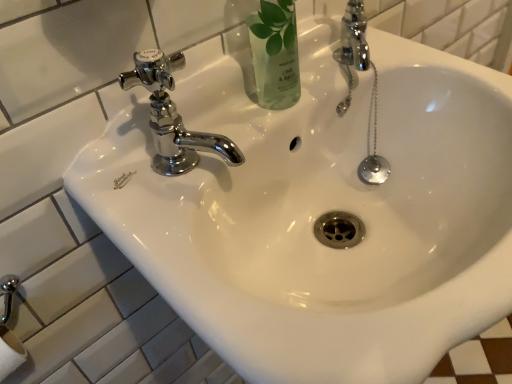
What do you see at coordinates (275, 54) in the screenshot? This screenshot has height=384, width=512. I see `clear glass bottle at upper center` at bounding box center [275, 54].

The width and height of the screenshot is (512, 384). What are the coordinates of `clear glass bottle at upper center` in the screenshot? It's located at (275, 54).

What do you see at coordinates (173, 117) in the screenshot?
I see `chrome/metallic faucet at upper left` at bounding box center [173, 117].

You are a GUI agent. You are given a task and a screenshot of the screen. Output one action in this format:
    pyautogui.click(x=<x>, y=<y>)
    Task: Click on the chrome/metallic faucet at upper left
    
    Given the screenshot: What is the action you would take?
    pyautogui.click(x=173, y=117)

I want to click on clear glass bottle at upper center, so 275,54.

Which is more to the right, clear glass bottle at upper center or chrome/metallic faucet at upper left?

Positioned to the right is clear glass bottle at upper center.

Considering the relative positions of clear glass bottle at upper center and chrome/metallic faucet at upper left in the image provided, is clear glass bottle at upper center behind chrome/metallic faucet at upper left?

Yes.

Does point (288, 49) appear closer or farther from the camera than point (155, 75)?

Point (288, 49) is positioned farther from the camera compared to point (155, 75).

From the image's perspective, which one is positioned lower, clear glass bottle at upper center or chrome/metallic faucet at upper left?

From the image's view, chrome/metallic faucet at upper left is below.

From a real-world perspective, is clear glass bottle at upper center located higher than chrome/metallic faucet at upper left?

Yes, from a real-world perspective, clear glass bottle at upper center is above chrome/metallic faucet at upper left.

Which of these two, clear glass bottle at upper center or chrome/metallic faucet at upper left, is thinner?

chrome/metallic faucet at upper left.

Considering the relative sizes of clear glass bottle at upper center and chrome/metallic faucet at upper left in the image provided, is clear glass bottle at upper center shorter than chrome/metallic faucet at upper left?

No.

Considering the sizes of objects clear glass bottle at upper center and chrome/metallic faucet at upper left in the image provided, who is bigger, clear glass bottle at upper center or chrome/metallic faucet at upper left?

clear glass bottle at upper center.

Consider the image. Is clear glass bottle at upper center spatially inside chrome/metallic faucet at upper left, or outside of it?

clear glass bottle at upper center is located beyond the bounds of chrome/metallic faucet at upper left.

From the picture: Are clear glass bottle at upper center and chrome/metallic faucet at upper left far apart?

They are positioned close to each other.

Based on the photo, is clear glass bottle at upper center facing away from chrome/metallic faucet at upper left?

That's not correct — clear glass bottle at upper center is not looking away from chrome/metallic faucet at upper left.

Can you tell me how much clear glass bottle at upper center and chrome/metallic faucet at upper left differ in facing direction?

0.00182 degrees.

Measure the distance between clear glass bottle at upper center and chrome/metallic faucet at upper left.

A distance of 11.08 centimeters exists between clear glass bottle at upper center and chrome/metallic faucet at upper left.

Image resolution: width=512 pixels, height=384 pixels. What are the coordinates of `mouthwash above the chrome/metallic faucet at upper left (from the image's perspective)` in the screenshot? It's located at (275, 54).

Is chrome/metallic faucet at upper left at the left side of clear glass bottle at upper center?

Yes.

Relative to clear glass bottle at upper center, is chrome/metallic faucet at upper left in front or behind?

Clearly, chrome/metallic faucet at upper left is in front of clear glass bottle at upper center.

Does point (120, 85) lie behind point (253, 62)?

No, it is not.

From the image's perspective, would you say chrome/metallic faucet at upper left is positioned over clear glass bottle at upper center?

No, from the image's perspective, chrome/metallic faucet at upper left is not above clear glass bottle at upper center.

From a real-world perspective, which object stands above the other?

clear glass bottle at upper center.

Considering the relative sizes of chrome/metallic faucet at upper left and clear glass bottle at upper center in the image provided, is chrome/metallic faucet at upper left wider than clear glass bottle at upper center?

In fact, chrome/metallic faucet at upper left might be narrower than clear glass bottle at upper center.

From their relative heights in the image, would you say chrome/metallic faucet at upper left is taller or shorter than clear glass bottle at upper center?

chrome/metallic faucet at upper left is shorter than clear glass bottle at upper center.

Considering the relative sizes of chrome/metallic faucet at upper left and clear glass bottle at upper center in the image provided, is chrome/metallic faucet at upper left bigger than clear glass bottle at upper center?

Incorrect, chrome/metallic faucet at upper left is not larger than clear glass bottle at upper center.

From the picture: Choose the correct answer: Is chrome/metallic faucet at upper left inside clear glass bottle at upper center or outside it?

chrome/metallic faucet at upper left exists outside the volume of clear glass bottle at upper center.

Is chrome/metallic faucet at upper left positioned far away from clear glass bottle at upper center?

Actually, chrome/metallic faucet at upper left and clear glass bottle at upper center are a little close together.

Does chrome/metallic faucet at upper left turn towards clear glass bottle at upper center?

No, chrome/metallic faucet at upper left is not oriented towards clear glass bottle at upper center.

Image resolution: width=512 pixels, height=384 pixels. Identify the location of tap on the left of clear glass bottle at upper center. (173, 117).

At what (x,y) coordinates should I click in order to perform the action: click on mouthwash on the right of the chrome/metallic faucet at upper left. Please return your answer as a coordinate pair (x, y). The width and height of the screenshot is (512, 384). Looking at the image, I should click on (275, 54).

In the image, there is a clear glass bottle at upper center. Identify the location of tap below it (from the image's perspective). The image size is (512, 384). (173, 117).